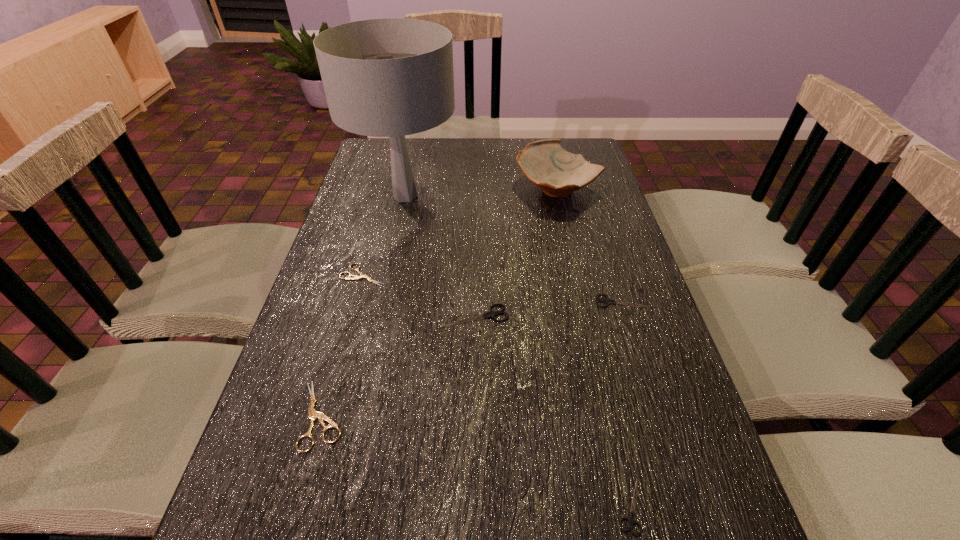
Identify the location of lampshade that is positioned at the far edge. (390, 77).

Locate an element on the screen. The height and width of the screenshot is (540, 960). pottery that is positioned at the far edge is located at coordinates (558, 173).

Find the location of `lampshade situated at the left edge`. lampshade situated at the left edge is located at coordinates (390, 77).

Locate an element on the screen. This screenshot has height=540, width=960. pottery present at the right edge is located at coordinates (558, 173).

Locate an element on the screen. This screenshot has height=540, width=960. object that is at the far left corner is located at coordinates (390, 77).

At what (x,y) coordinates should I click in order to perform the action: click on object that is positioned at the far right corner. Please return your answer as a coordinate pair (x, y). Looking at the image, I should click on (558, 173).

In the image, there is a desktop. At what (x,y) coordinates should I click in order to perform the action: click on blank space at the far edge. Please return your answer as a coordinate pair (x, y). Looking at the image, I should click on (473, 164).

Identify the location of free space at the left edge. (318, 294).

This screenshot has height=540, width=960. I want to click on free space at the right edge of the desktop, so click(609, 320).

Locate an element on the screen. The image size is (960, 540). vacant space at the far left corner is located at coordinates (370, 170).